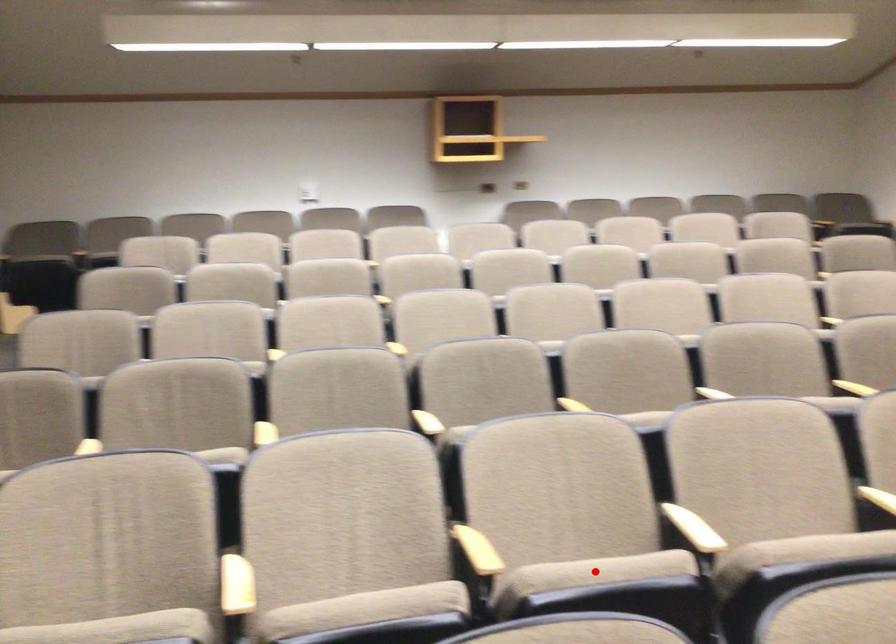
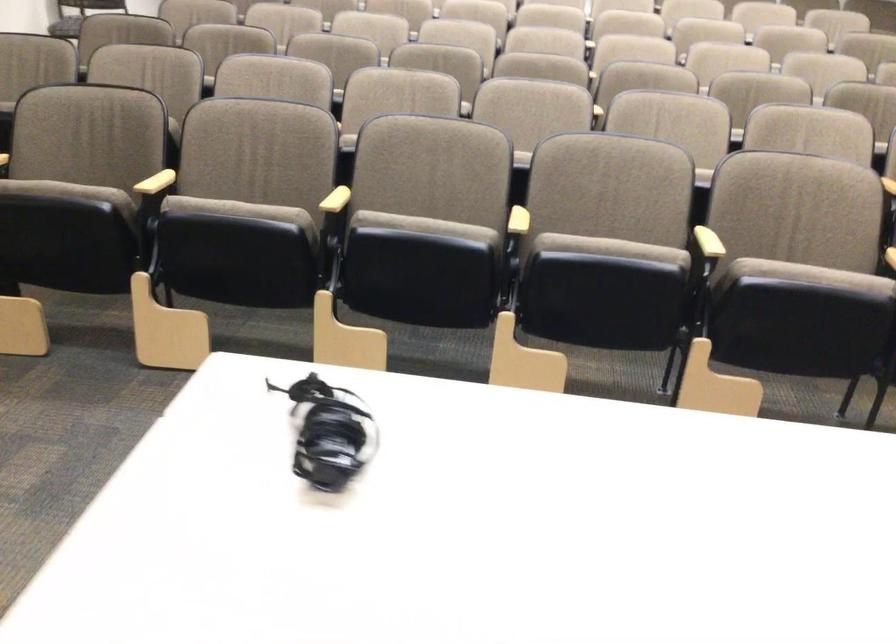
Question: I am providing you with two images of the same scene from different viewpoints. A red point is marked on the first image. Can you still see the location of the red point in image 2?

Choices:
 (A) Yes
 (B) No

Answer: (B)